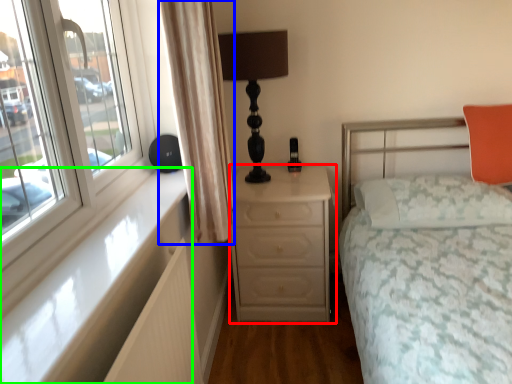
Question: Based on their relative distances, which object is farther from chest of drawers (highlighted by a red box)? Choose from curtain (highlighted by a blue box) and window sill (highlighted by a green box).

Choices:
 (A) curtain
 (B) window sill

Answer: (B)